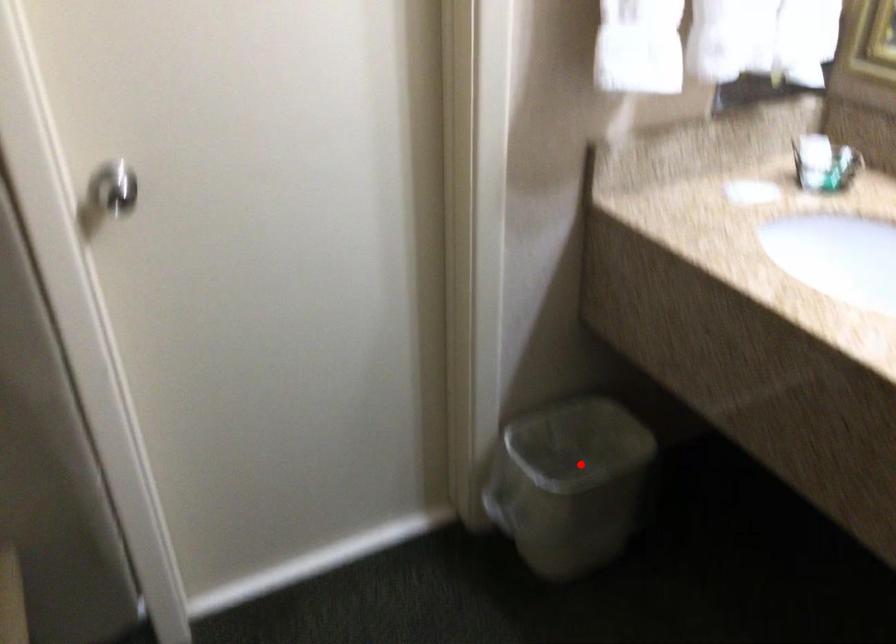
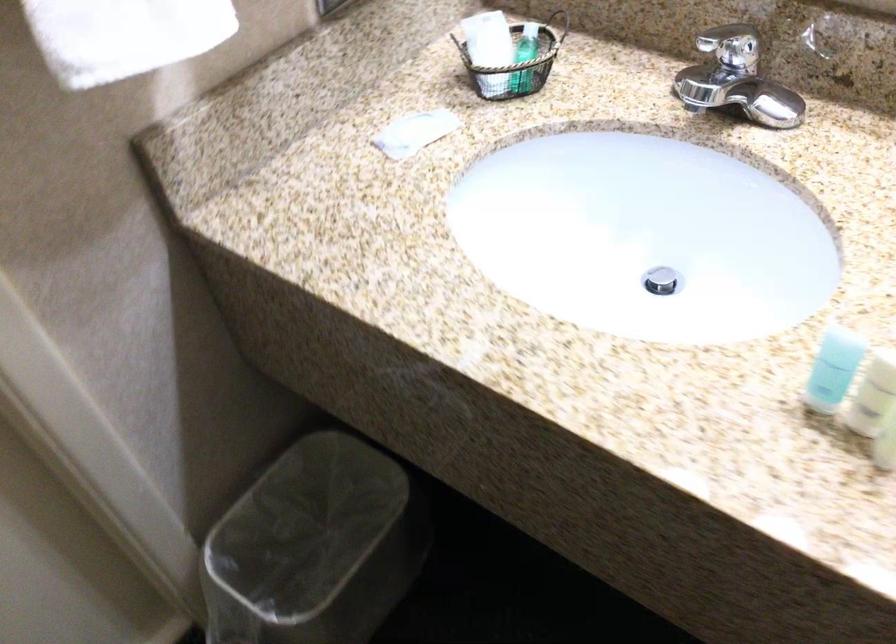
Question: I am providing you with two images of the same scene from different viewpoints. Given a red point in image1, look at the same physical point in image2. Is it:

Choices:
 (A) Closer to the viewpoint
 (B) Farther from the viewpoint

Answer: (A)